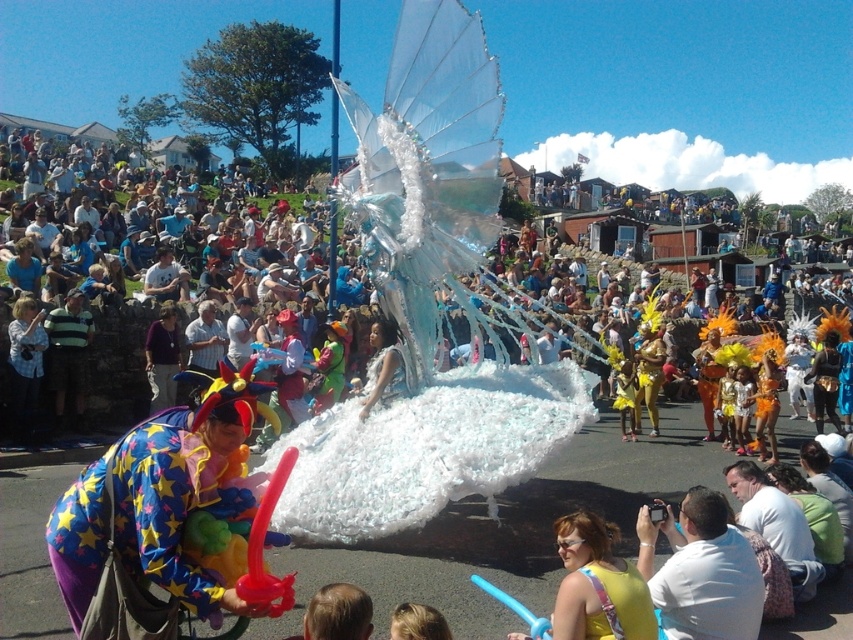
You are standing at the point marked as point (242, 467) in the image. The float is 90 feet away from you. Is the float closer to you than the street performers?

The float is 90 feet away from you, so the float is closer than the street performers.

You are organizing a street parade and want to place a sign between the rubber clown toy at lower left and the white matte balloon at center. Which object should the sign be closer to to ensure it doesn

The sign should be closer to the white matte balloon at center because the rubber clown toy at lower left is wider than the white matte balloon at center, so placing the sign near the narrower object would balance the spacing.

You are a photographer taking pictures of the street parade. You see the rubber clown toy at lower left and the white matte balloon at center. Which object should you focus on if you want to capture something higher in the image?

The rubber clown toy at lower left is located above the white matte balloon at center, so you should focus on the rubber clown toy at lower left to capture something higher in the image.